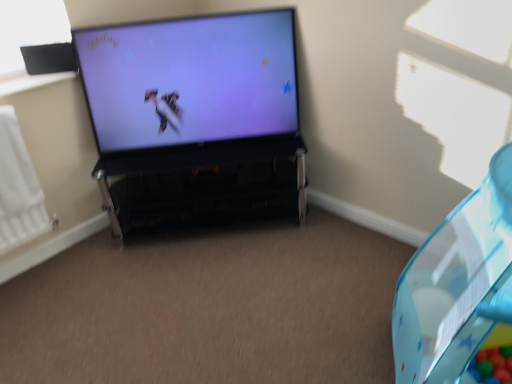
Question: From a real-world perspective, is transparent plastic bean bag chair at right over black glossy tv stand at center?

Choices:
 (A) no
 (B) yes

Answer: (B)

Question: Is black glossy tv stand at center inside transparent plastic bean bag chair at right?

Choices:
 (A) yes
 (B) no

Answer: (B)

Question: From a real-world perspective, is transparent plastic bean bag chair at right below black glossy tv stand at center?

Choices:
 (A) yes
 (B) no

Answer: (B)

Question: From the image's perspective, is transparent plastic bean bag chair at right located above black glossy tv stand at center?

Choices:
 (A) yes
 (B) no

Answer: (B)

Question: Does transparent plastic bean bag chair at right appear on the left side of black glossy tv stand at center?

Choices:
 (A) no
 (B) yes

Answer: (A)

Question: Does transparent plastic bean bag chair at right have a greater width compared to black glossy tv stand at center?

Choices:
 (A) yes
 (B) no

Answer: (A)

Question: Is white matte radiator at left surrounding black matte speaker at upper left?

Choices:
 (A) no
 (B) yes

Answer: (A)

Question: Does white matte radiator at left have a lesser height compared to black matte speaker at upper left?

Choices:
 (A) yes
 (B) no

Answer: (B)

Question: Is white matte radiator at left smaller than black matte speaker at upper left?

Choices:
 (A) no
 (B) yes

Answer: (A)

Question: Does white matte radiator at left have a greater width compared to black matte speaker at upper left?

Choices:
 (A) no
 (B) yes

Answer: (B)

Question: Does white matte radiator at left come behind black matte speaker at upper left?

Choices:
 (A) yes
 (B) no

Answer: (B)

Question: Would you consider white matte radiator at left to be distant from black matte speaker at upper left?

Choices:
 (A) yes
 (B) no

Answer: (B)

Question: From a real-world perspective, does black glossy tv stand at center sit lower than white matte radiator at left?

Choices:
 (A) no
 (B) yes

Answer: (B)